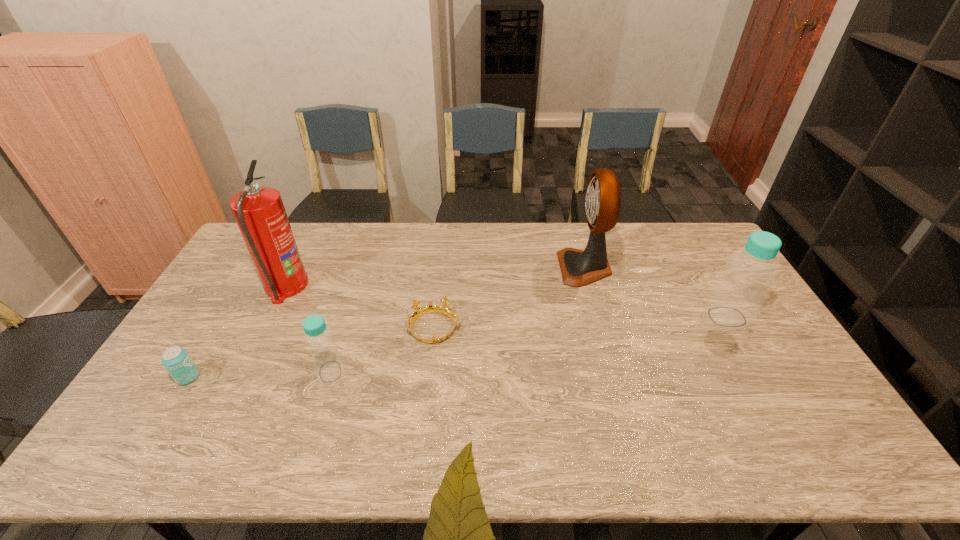
Where is `vacant space located on the left of the nearer bottle`? The image size is (960, 540). vacant space located on the left of the nearer bottle is located at coordinates (174, 372).

Find the location of a particular element. The width and height of the screenshot is (960, 540). vacant space located on the left of the taller bottle is located at coordinates (603, 317).

Identify the location of blank area located on the instruction side of the fire extinguisher. (322, 286).

At what (x,y) coordinates should I click in order to perform the action: click on free space located 0.210m on the front-facing side of the fan. Please return your answer as a coordinate pair (x, y). The height and width of the screenshot is (540, 960). Looking at the image, I should click on (500, 268).

The height and width of the screenshot is (540, 960). Find the location of `free spot located 0.390m on the front-facing side of the fan`. free spot located 0.390m on the front-facing side of the fan is located at coordinates (448, 268).

Locate an element on the screen. free space located on the front-facing side of the fan is located at coordinates (457, 268).

Identify the location of free region located 0.350m on the right of the shortest object. The width and height of the screenshot is (960, 540). (576, 328).

The image size is (960, 540). Identify the location of vacant space located on the back of the second shortest object. (218, 328).

Locate an element on the screen. The image size is (960, 540). object that is at the far edge is located at coordinates (578, 268).

The height and width of the screenshot is (540, 960). I want to click on fire extinguisher located in the left edge section of the desktop, so click(x=259, y=212).